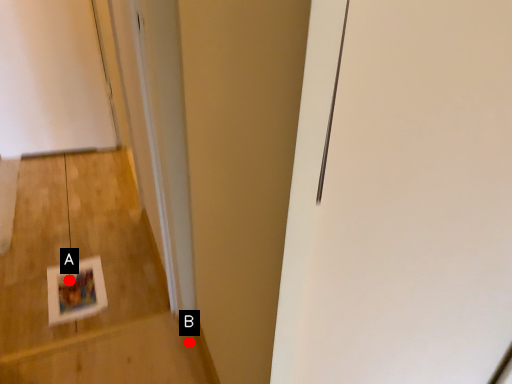
Question: Two points are circled on the image, labeled by A and B beside each circle. Which point is closer to the camera taking this photo?

Choices:
 (A) A is closer
 (B) B is closer

Answer: (B)